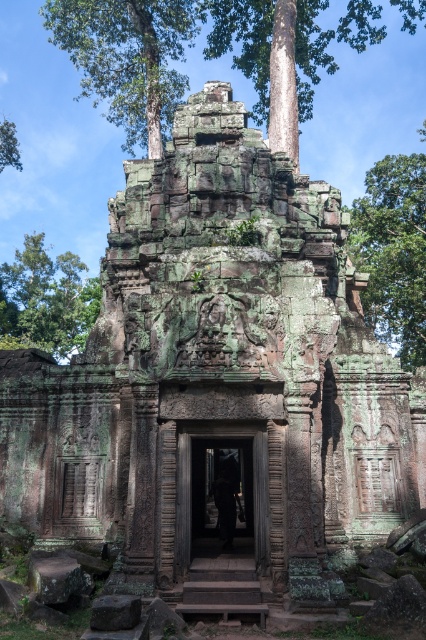
You are an archaeologist examining the ancient stone structure. You notice a point at coordinates [285,52]. What object is located at this point?

The green mossy stone at upper center is located at point [285,52].

You are an archaeologist examining the ancient stone structure. You notice the green mossy stone at upper center and the green mossy tree at left. Which object is closer to you as you stand at the entrance?

The green mossy stone at upper center is closer to you because it is in front of the green mossy tree at left.

You are an archaeologist examining the ancient stone structure. You notice the green mossy tree at upper right and the carved stone doorway at center. Based on their positions, which object is located to the east of the other?

The green mossy tree at upper right is to the right of the carved stone doorway at center, so if the structure faces north, the green mossy tree at upper right would be to the east of the carved stone doorway at center.